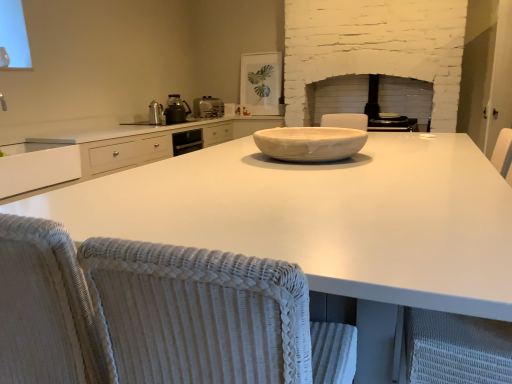
Question: Which direction should I rotate to look at matte black toaster at center, which ranks as the 2th appliance in front-to-back order?

Choices:
 (A) left
 (B) right

Answer: (B)

Question: Considering the relative sizes of metallic silver kettle at center-left, the 1th appliance viewed from the front, and metallic black kettle at upper left, which is the 3th appliance in right-to-left order, in the image provided, is metallic silver kettle at center-left, the 1th appliance viewed from the front, taller than metallic black kettle at upper left, which is the 3th appliance in right-to-left order,?

Choices:
 (A) no
 (B) yes

Answer: (A)

Question: Can you confirm if metallic silver kettle at center-left, the fourth appliance from the back, is shorter than metallic black kettle at upper left, which is the 3th appliance from front to back?

Choices:
 (A) yes
 (B) no

Answer: (A)

Question: Is metallic black kettle at upper left, which is the 3th appliance in right-to-left order, completely or partially inside metallic silver kettle at center-left, placed as the 4th appliance when sorted from right to left?

Choices:
 (A) no
 (B) yes

Answer: (A)

Question: From a real-world perspective, is metallic silver kettle at center-left, placed as the 4th appliance when sorted from right to left, physically above metallic black kettle at upper left, the 2th appliance when ordered from left to right?

Choices:
 (A) yes
 (B) no

Answer: (B)

Question: Is metallic silver kettle at center-left, placed as the 4th appliance when sorted from right to left, looking in the opposite direction of metallic black kettle at upper left, which is the 3th appliance in right-to-left order?

Choices:
 (A) no
 (B) yes

Answer: (A)

Question: Is the position of metallic silver kettle at center-left, which is the 1th appliance in left-to-right order, less distant than that of metallic black kettle at upper left, which is the 3th appliance from front to back?

Choices:
 (A) yes
 (B) no

Answer: (A)

Question: Are white glossy countertop at center and satin silver toaster at upper center making contact?

Choices:
 (A) yes
 (B) no

Answer: (B)

Question: Is white glossy countertop at center far away from satin silver toaster at upper center?

Choices:
 (A) no
 (B) yes

Answer: (B)

Question: Does white glossy countertop at center have a greater width compared to satin silver toaster at upper center?

Choices:
 (A) yes
 (B) no

Answer: (A)

Question: Considering the relative sizes of white glossy countertop at center and satin silver toaster at upper center in the image provided, is white glossy countertop at center thinner than satin silver toaster at upper center?

Choices:
 (A) yes
 (B) no

Answer: (B)

Question: From the image's perspective, is white glossy countertop at center above satin silver toaster at upper center?

Choices:
 (A) yes
 (B) no

Answer: (B)

Question: From the image's perspective, is white glossy countertop at center beneath satin silver toaster at upper center?

Choices:
 (A) no
 (B) yes

Answer: (B)

Question: From a real-world perspective, is white woven armchair at right located higher than satin silver toaster at upper center?

Choices:
 (A) no
 (B) yes

Answer: (A)